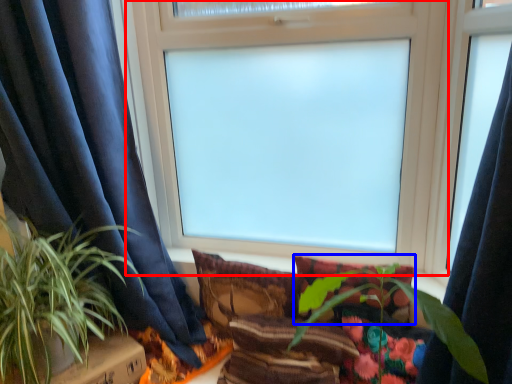
Question: Which point is further to the camera, window (highlighted by a red box) or pillow (highlighted by a blue box)?

Choices:
 (A) window
 (B) pillow

Answer: (B)